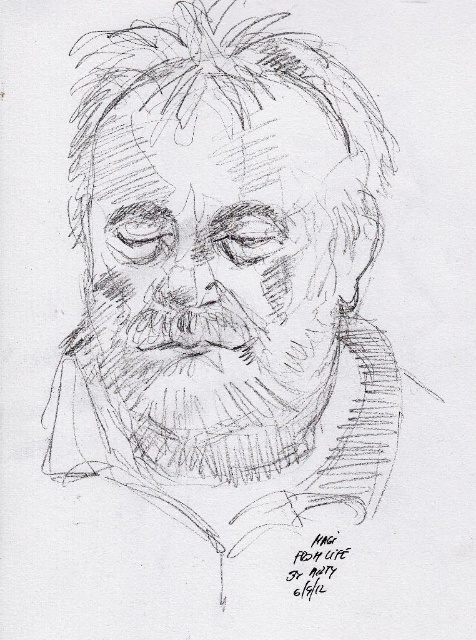
Looking at the pencil sketch, where is the pencil sketch face at center in relation to the shaggy pencil beard at center?

The pencil sketch face at center is to the right of the shaggy pencil beard at center.

You are an art student who wants to draw a face that appears closer to the viewer than the one in the image. How much closer should you draw it compared to the pencil sketch face at center?

The pencil sketch face at center is 21.64 inches from the viewer. To make the face appear closer, you should draw it less than 21.64 inches away from the viewer.

You are an art student analyzing the pencil sketch. You notice the pencil sketch face at center and the shaggy pencil beard at center. Which object is positioned higher in the drawing?

The pencil sketch face at center is positioned higher than the shaggy pencil beard at center in the drawing.